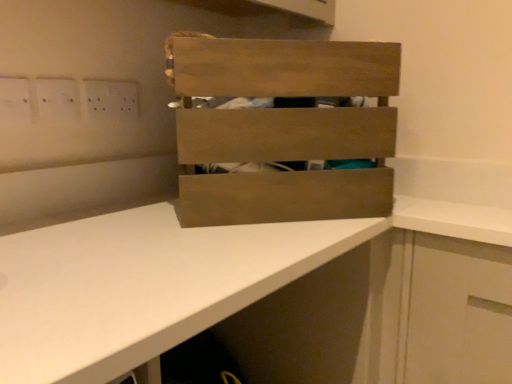
Question: Can you confirm if white plastic electric outlet at upper left is thinner than white matte countertop at center?

Choices:
 (A) no
 (B) yes

Answer: (B)

Question: Is white plastic electric outlet at upper left looking in the opposite direction of white matte countertop at center?

Choices:
 (A) yes
 (B) no

Answer: (B)

Question: From a real-world perspective, is white plastic electric outlet at upper left located beneath white matte countertop at center?

Choices:
 (A) yes
 (B) no

Answer: (B)

Question: From a real-world perspective, is white plastic electric outlet at upper left over white matte countertop at center?

Choices:
 (A) yes
 (B) no

Answer: (A)

Question: Would you say white plastic electric outlet at upper left is outside white matte countertop at center?

Choices:
 (A) no
 (B) yes

Answer: (B)

Question: Considering the positions of wooden crate at center and white matte countertop at center in the image, is wooden crate at center wider or thinner than white matte countertop at center?

Choices:
 (A) wide
 (B) thin

Answer: (B)

Question: In the image, is wooden crate at center positioned in front of or behind white matte countertop at center?

Choices:
 (A) front
 (B) behind

Answer: (B)

Question: Would you say wooden crate at center is to the left or to the right of white matte countertop at center in the picture?

Choices:
 (A) right
 (B) left

Answer: (A)

Question: In terms of height, does wooden crate at center look taller or shorter compared to white matte countertop at center?

Choices:
 (A) tall
 (B) short

Answer: (B)

Question: Considering the positions of white plastic electric outlet at upper left and wooden crate at center in the image, is white plastic electric outlet at upper left wider or thinner than wooden crate at center?

Choices:
 (A) wide
 (B) thin

Answer: (B)

Question: From the image's perspective, is white plastic electric outlet at upper left located above or below wooden crate at center?

Choices:
 (A) above
 (B) below

Answer: (A)

Question: Visually, is white plastic electric outlet at upper left positioned to the left or to the right of wooden crate at center?

Choices:
 (A) right
 (B) left

Answer: (B)

Question: Is white plastic electric outlet at upper left bigger or smaller than wooden crate at center?

Choices:
 (A) big
 (B) small

Answer: (B)

Question: From the image's perspective, is white matte countertop at center located above or below white plastic electric outlet at upper left?

Choices:
 (A) above
 (B) below

Answer: (B)

Question: Considering the positions of white matte countertop at center and white plastic electric outlet at upper left in the image, is white matte countertop at center wider or thinner than white plastic electric outlet at upper left?

Choices:
 (A) thin
 (B) wide

Answer: (B)